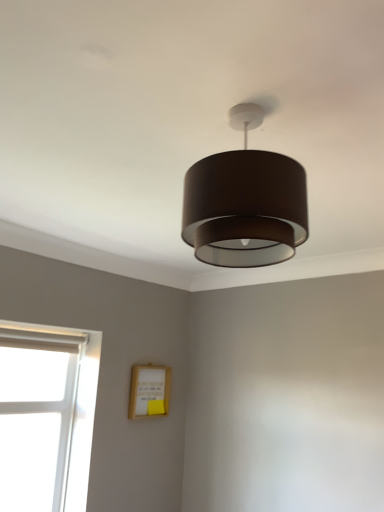
Describe the element at coordinates (149, 391) in the screenshot. I see `wooden picture frame at lower center` at that location.

Where is `wooden picture frame at lower center`? Image resolution: width=384 pixels, height=512 pixels. wooden picture frame at lower center is located at coordinates (149, 391).

What is the approximate width of wooden picture frame at lower center?

The width of wooden picture frame at lower center is 2.52 inches.

In order to face wooden picture frame at lower center, should I rotate leftwards or rightwards?

To align with it, rotate left about 5.112°.

At what (x,y) coordinates should I click in order to perform the action: click on wooden picture frame at lower center. Please return your answer as a coordinate pair (x, y). This screenshot has height=512, width=384. Looking at the image, I should click on (149, 391).